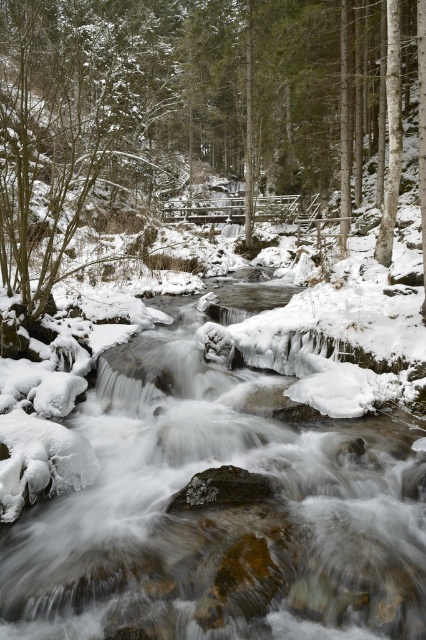
Can you confirm if icy smooth water at center is wider than snowy evergreen tree at center?

No, icy smooth water at center is not wider than snowy evergreen tree at center.

Measure the distance between icy smooth water at center and camera.

icy smooth water at center and camera are 5.11 meters apart from each other.

Describe the element at coordinates (210, 512) in the screenshot. I see `icy smooth water at center` at that location.

Image resolution: width=426 pixels, height=640 pixels. In order to click on icy smooth water at center in this screenshot , I will do `click(210, 512)`.

Who is shorter, icy smooth water at center or snowy bark tree at center?

Standing shorter between the two is icy smooth water at center.

The image size is (426, 640). Describe the element at coordinates (210, 512) in the screenshot. I see `icy smooth water at center` at that location.

Is point (103, 548) farther from viewer compared to point (9, 33)?

No, it is in front of (9, 33).

Where is `icy smooth water at center`? icy smooth water at center is located at coordinates (210, 512).

Looking at this image, who is more forward, (138,84) or (121,170)?

Point (121,170) is more forward.

This screenshot has width=426, height=640. What do you see at coordinates (176, 108) in the screenshot?
I see `snowy evergreen tree at center` at bounding box center [176, 108].

This screenshot has width=426, height=640. I want to click on snowy evergreen tree at center, so click(x=176, y=108).